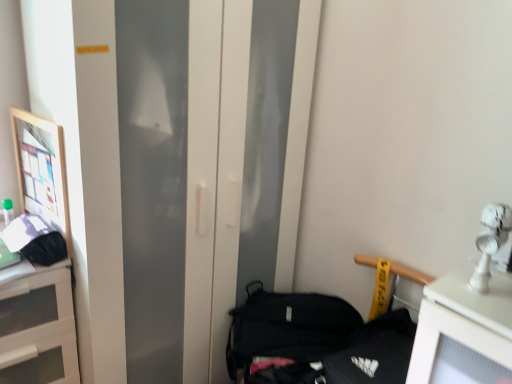
Question: Can you confirm if matte black handbag at left, which is the second handbag in right-to-left order, is positioned to the left of black fabric handbag at lower right, the first handbag from the right?

Choices:
 (A) no
 (B) yes

Answer: (B)

Question: From a real-world perspective, is matte black handbag at left, which is the 2th handbag from bottom to top, on black fabric handbag at lower right, which is the 2th handbag from left to right?

Choices:
 (A) no
 (B) yes

Answer: (B)

Question: Does matte black handbag at left, which is the second handbag in right-to-left order, have a larger size compared to black fabric handbag at lower right, the first handbag from the right?

Choices:
 (A) yes
 (B) no

Answer: (B)

Question: From the image's perspective, is matte black handbag at left, which is the 2th handbag from bottom to top, under black fabric handbag at lower right, the second handbag in the top-to-bottom sequence?

Choices:
 (A) no
 (B) yes

Answer: (A)

Question: Can black fabric handbag at lower right, the first handbag from the bottom, be found inside matte black handbag at left, marked as the first handbag in a left-to-right arrangement?

Choices:
 (A) no
 (B) yes

Answer: (A)

Question: In the image, is black fabric handbag at lower right, which is the 2th handbag from left to right, positioned in front of or behind matte black handbag at left, marked as the first handbag in a left-to-right arrangement?

Choices:
 (A) behind
 (B) front

Answer: (A)

Question: In terms of height, does black fabric handbag at lower right, the first handbag from the bottom, look taller or shorter compared to matte black handbag at left, which is the second handbag in right-to-left order?

Choices:
 (A) tall
 (B) short

Answer: (A)

Question: Considering the positions of black fabric handbag at lower right, the first handbag from the bottom, and matte black handbag at left, marked as the first handbag in a left-to-right arrangement, in the image, is black fabric handbag at lower right, the first handbag from the bottom, bigger or smaller than matte black handbag at left, marked as the first handbag in a left-to-right arrangement,?

Choices:
 (A) small
 (B) big

Answer: (B)

Question: Looking at their shapes, would you say black fabric handbag at lower right, which is the 2th handbag from left to right, is wider or thinner than matte black handbag at left, the 1th handbag viewed from the top?

Choices:
 (A) thin
 (B) wide

Answer: (B)

Question: Is black fabric handbag at lower right, the first handbag from the right, inside or outside of white matte cabinet at left?

Choices:
 (A) inside
 (B) outside

Answer: (B)

Question: Visually, is black fabric handbag at lower right, which is the 2th handbag from left to right, positioned to the left or to the right of white matte cabinet at left?

Choices:
 (A) left
 (B) right

Answer: (B)

Question: From the image's perspective, is black fabric handbag at lower right, the first handbag from the bottom, located above or below white matte cabinet at left?

Choices:
 (A) below
 (B) above

Answer: (B)

Question: In terms of size, does black fabric handbag at lower right, the first handbag from the bottom, appear bigger or smaller than white matte cabinet at left?

Choices:
 (A) small
 (B) big

Answer: (A)

Question: Considering the relative positions of matte black handbag at left, which is the second handbag in right-to-left order, and black fabric handbag at lower right, the first handbag from the bottom, in the image provided, is matte black handbag at left, which is the second handbag in right-to-left order, to the left or to the right of black fabric handbag at lower right, the first handbag from the bottom,?

Choices:
 (A) left
 (B) right

Answer: (A)

Question: Does point (52, 256) appear closer or farther from the camera than point (292, 340)?

Choices:
 (A) farther
 (B) closer

Answer: (B)